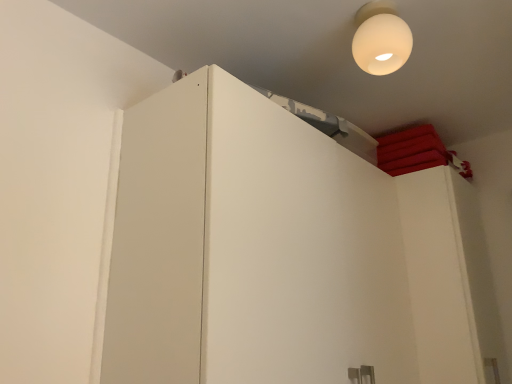
This screenshot has width=512, height=384. What do you see at coordinates (382, 43) in the screenshot? I see `matte white globe at upper right` at bounding box center [382, 43].

In order to click on matte white globe at upper right in this screenshot , I will do `click(382, 43)`.

Find the location of a particular element. The image size is (512, 384). matte white globe at upper right is located at coordinates (382, 43).